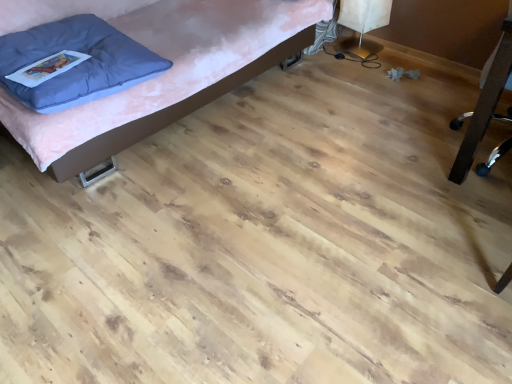
Question: From a real-world perspective, is black plastic chair at right, which ranks as the first furniture in right-to-left order, physically located above or below blue soft pillow at upper left?

Choices:
 (A) above
 (B) below

Answer: (B)

Question: In terms of height, does black plastic chair at right, which ranks as the first furniture in right-to-left order, look taller or shorter compared to blue soft pillow at upper left?

Choices:
 (A) tall
 (B) short

Answer: (A)

Question: Which object is positioned closest to the blue soft pillow at upper left?

Choices:
 (A) matte pink bed at upper left, which is the second furniture in right-to-left order
 (B) black plastic chair at right, the 2th furniture viewed from the left

Answer: (A)

Question: Which object is the closest to the blue soft pillow at upper left?

Choices:
 (A) black plastic chair at right, the 2th furniture viewed from the left
 (B) matte pink bed at upper left, which is the second furniture in right-to-left order

Answer: (B)